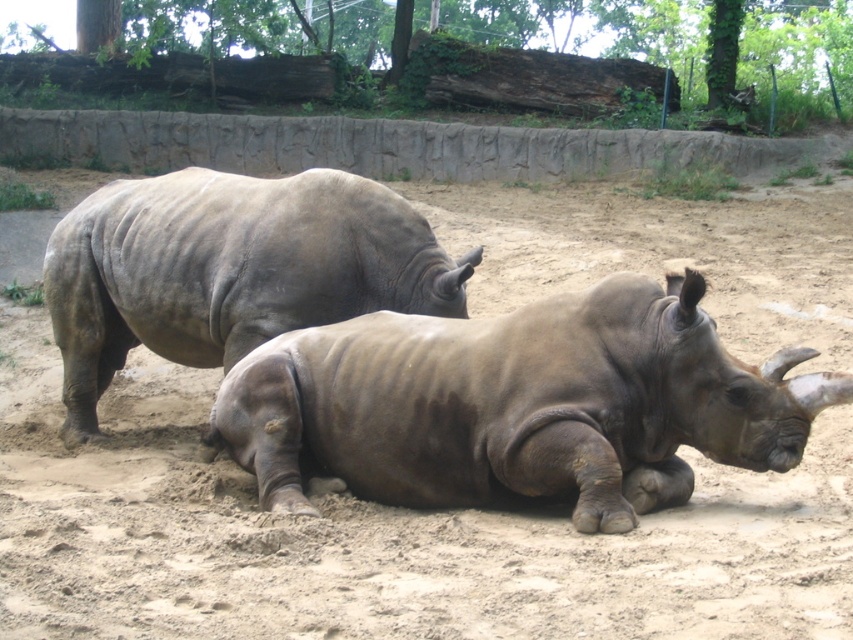
Between matte gray rhino at lower center and gray matte rhinoceros at center, which one has more height?

Standing taller between the two is gray matte rhinoceros at center.

Is matte gray rhino at lower center taller than gray matte rhinoceros at center?

Incorrect, matte gray rhino at lower center's height is not larger of gray matte rhinoceros at center's.

Between point (506, 472) and point (62, 337), which one is positioned behind?

Positioned behind is point (62, 337).

You are a GUI agent. You are given a task and a screenshot of the screen. Output one action in this format:
    pyautogui.click(x=<x>, y=<y>)
    Task: Click on the matte gray rhino at lower center
    This screenshot has height=640, width=853.
    Given the screenshot: What is the action you would take?
    pyautogui.click(x=518, y=404)